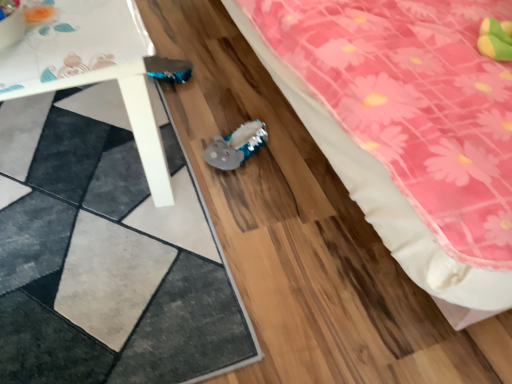
I want to click on free spot above textured gray rug at lower left (from a real-world perspective), so click(87, 226).